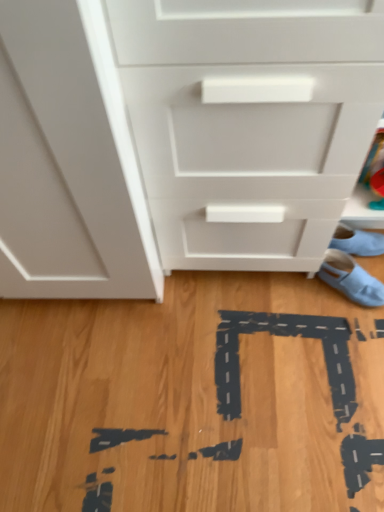
Question: Is light blue fabric shoe at lower right, which is counted as the 1th footwear, starting from the top, not close to white matte chest of drawers at center?

Choices:
 (A) no
 (B) yes

Answer: (A)

Question: Could you tell me if light blue fabric shoe at lower right, marked as the second footwear in a bottom-to-top arrangement, is facing white matte chest of drawers at center?

Choices:
 (A) no
 (B) yes

Answer: (A)

Question: Considering the relative sizes of light blue fabric shoe at lower right, marked as the second footwear in a bottom-to-top arrangement, and white matte chest of drawers at center in the image provided, is light blue fabric shoe at lower right, marked as the second footwear in a bottom-to-top arrangement, thinner than white matte chest of drawers at center?

Choices:
 (A) yes
 (B) no

Answer: (A)

Question: From the image's perspective, is light blue fabric shoe at lower right, which is counted as the 1th footwear, starting from the top, beneath white matte chest of drawers at center?

Choices:
 (A) no
 (B) yes

Answer: (B)

Question: Can you confirm if light blue fabric shoe at lower right, which is counted as the 1th footwear, starting from the top, is shorter than white matte chest of drawers at center?

Choices:
 (A) yes
 (B) no

Answer: (A)

Question: Does light blue fabric shoe at lower right, which is counted as the 1th footwear, starting from the top, appear on the left side of white matte chest of drawers at center?

Choices:
 (A) no
 (B) yes

Answer: (A)

Question: Is light blue fabric shoe at lower right, which is counted as the 1th footwear, starting from the top, at the back of white matte chest of drawers at center?

Choices:
 (A) no
 (B) yes

Answer: (A)

Question: Does white matte chest of drawers at center have a smaller size compared to light blue fabric shoe at lower right, marked as the second footwear in a bottom-to-top arrangement?

Choices:
 (A) no
 (B) yes

Answer: (A)

Question: Is white matte chest of drawers at center at the left side of light blue fabric shoe at lower right, marked as the second footwear in a bottom-to-top arrangement?

Choices:
 (A) yes
 (B) no

Answer: (A)

Question: Does white matte chest of drawers at center have a lesser width compared to light blue fabric shoe at lower right, marked as the second footwear in a bottom-to-top arrangement?

Choices:
 (A) yes
 (B) no

Answer: (B)

Question: From the image's perspective, is white matte chest of drawers at center on light blue fabric shoe at lower right, marked as the second footwear in a bottom-to-top arrangement?

Choices:
 (A) yes
 (B) no

Answer: (A)

Question: Is white matte chest of drawers at center further to the viewer compared to light blue fabric shoe at lower right, marked as the second footwear in a bottom-to-top arrangement?

Choices:
 (A) yes
 (B) no

Answer: (B)

Question: Can you confirm if light blue fabric shoe at lower right, which is counted as the 1th footwear, starting from the top, is taller than light blue fabric shoe at lower right, the 2th footwear viewed from the top?

Choices:
 (A) yes
 (B) no

Answer: (A)